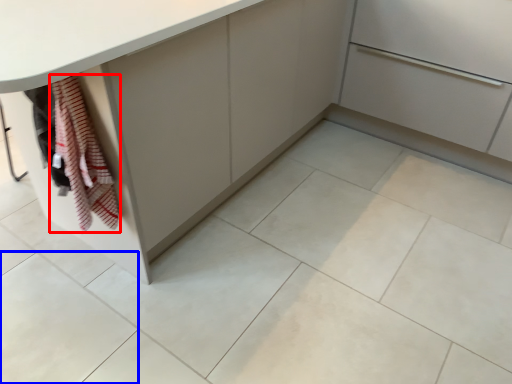
Question: Among these objects, which one is farthest to the camera, blanket (highlighted by a red box) or ceramic tile (highlighted by a blue box)?

Choices:
 (A) blanket
 (B) ceramic tile

Answer: (B)